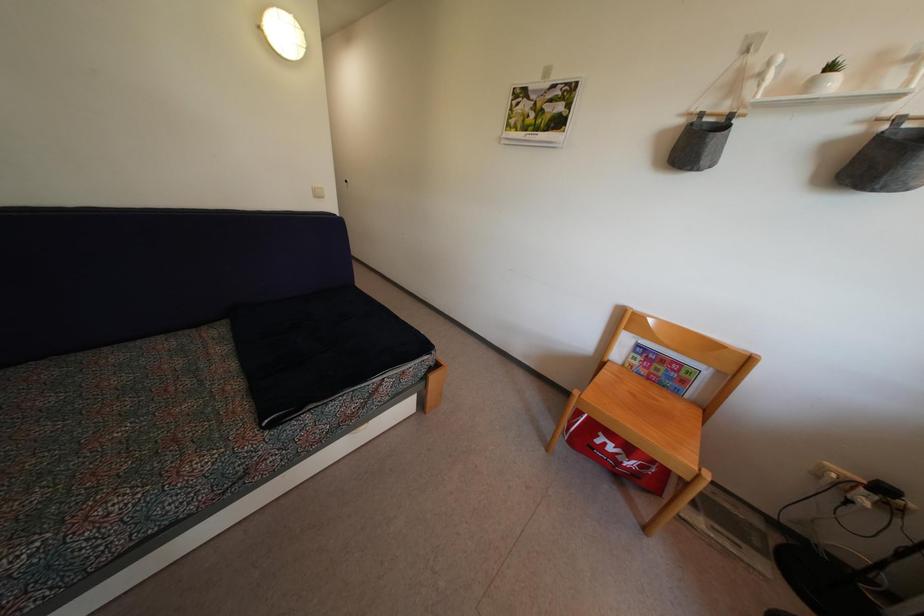
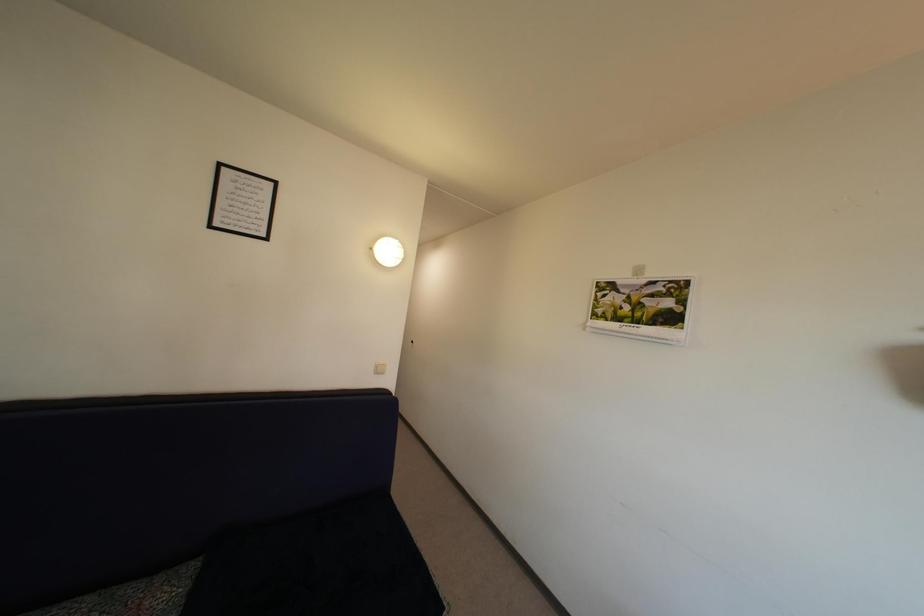
Question: The images are taken continuously from a first-person perspective. In which direction is your viewpoint rotating?

Choices:
 (A) Left
 (B) Right
 (C) Up
 (D) Down

Answer: (C)